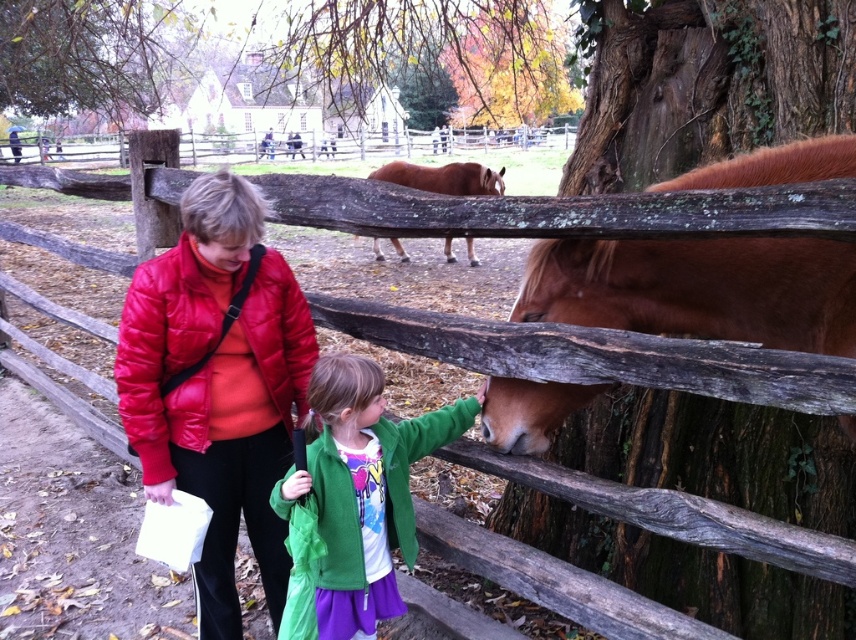
You are standing at the point labeled point (159,452) and want to walk to the point labeled point (449,189). Based on the scene, will you be moving towards the fence or away from it?

Since point (159,452) is in front of point (449,189), moving from the former to the latter means you are moving away from the fence.